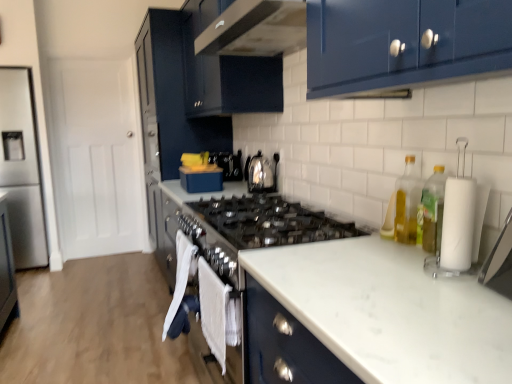
Locate an element on the screen. The image size is (512, 384). free space to the left of yellow translucent bottle at right, placed as the second bottle when sorted from back to front is located at coordinates (382, 251).